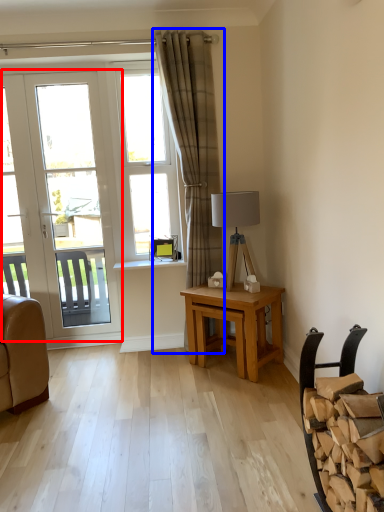
Question: Which object is closer to the camera taking this photo, door (highlighted by a red box) or curtain (highlighted by a blue box)?

Choices:
 (A) door
 (B) curtain

Answer: (B)